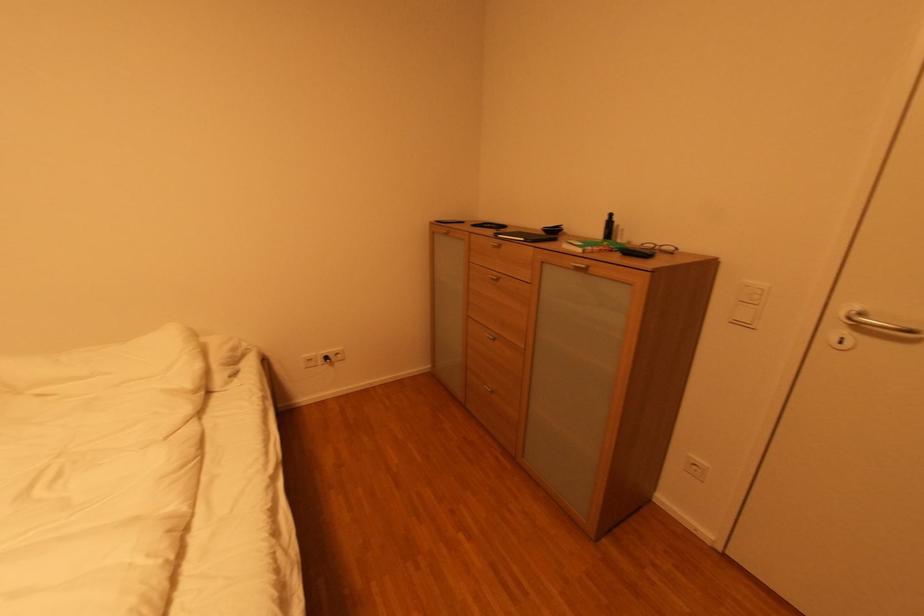
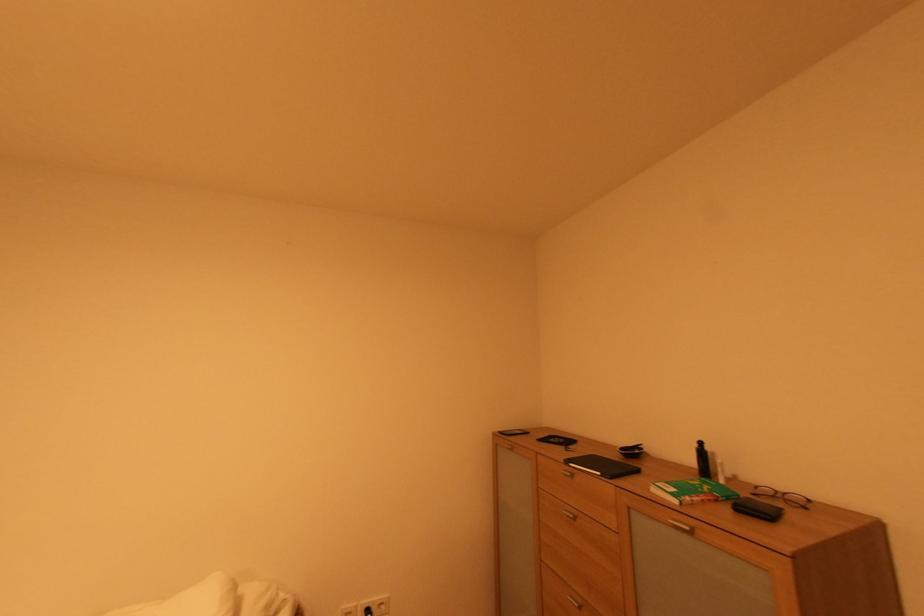
The point at (660, 246) is marked in the first image. Where is the corresponding point in the second image?

(777, 493)